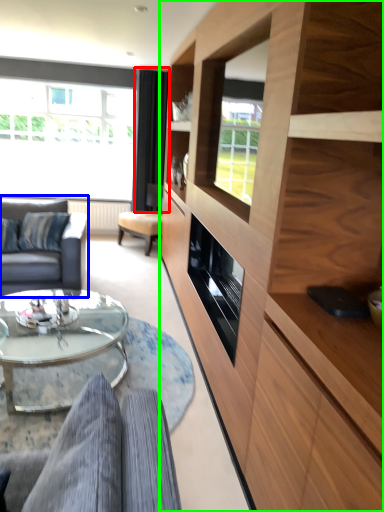
Question: Which object is positioned closest to curtain (highlighted by a red box)? Select from studio couch (highlighted by a blue box) and cabinetry (highlighted by a green box).

Choices:
 (A) studio couch
 (B) cabinetry

Answer: (A)